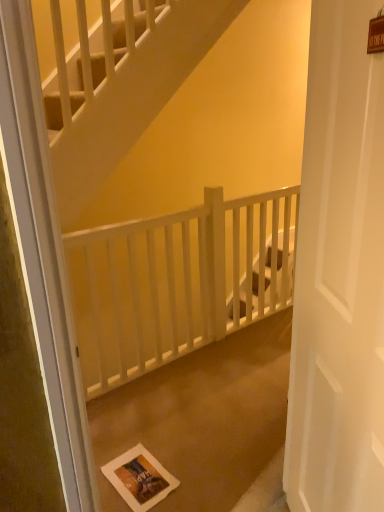
Locate an element on the screen. The image size is (384, 512). free space above white paper postcard at lower center (from a real-world perspective) is located at coordinates (145, 479).